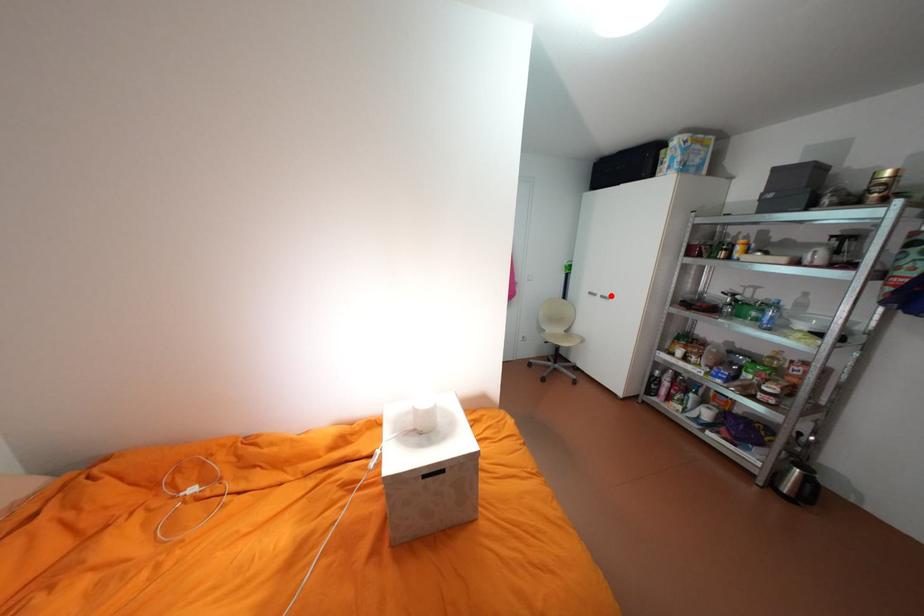
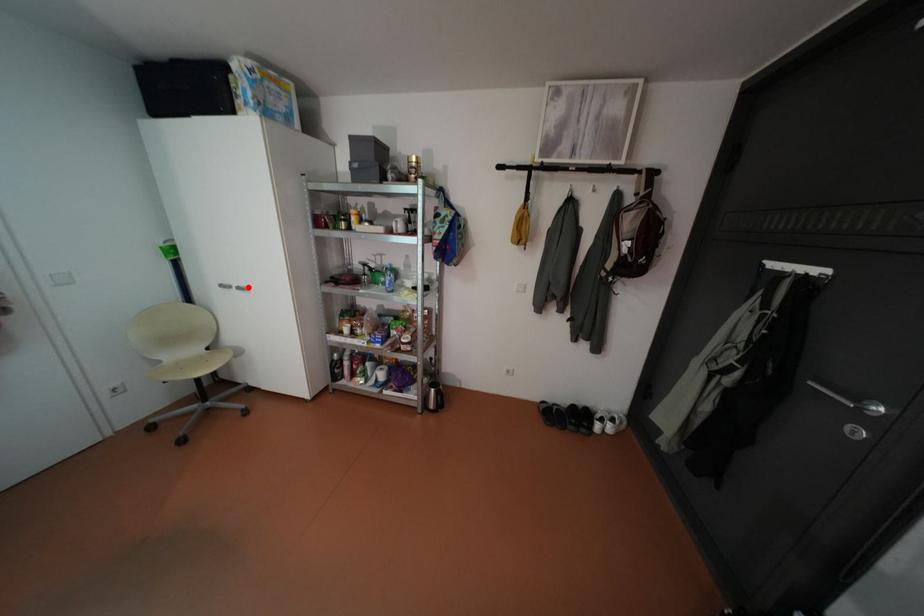
I am providing you with two images of the same scene from different viewpoints. A red point is marked on the first image and another point is marked on the second image. Is the marked point in image1 the same physical position as the marked point in image2?

Yes